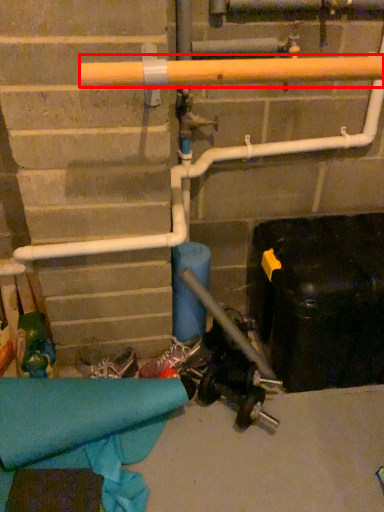
Question: In this image, where is beam (annotated by the red box) located relative to footwear?

Choices:
 (A) right
 (B) left

Answer: (A)